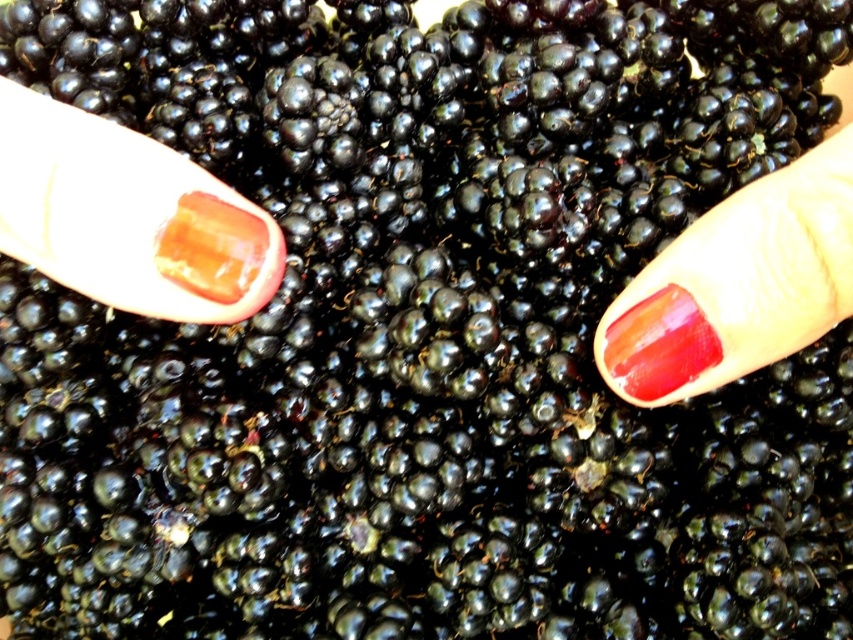
You are a nail technician trying to apply a design between the glossy acrylic nail at upper left and the glossy red nail polish at center. Given that your tool requires a minimum of 15 inches of space to operate, can you perform the task?

The distance between the glossy acrylic nail at upper left and the glossy red nail polish at center is 16.09 inches, which is sufficient for the tool requiring 15 inches of space. Therefore, you can perform the task.

You are trying to place the translucent amber cube at center on top of the red glossy nail at center. Based on their sizes, will the cube fit securely on the nail?

The red glossy nail at center is wider than the translucent amber cube at center, so the cube will fit securely on the nail since the nail provides a stable base.